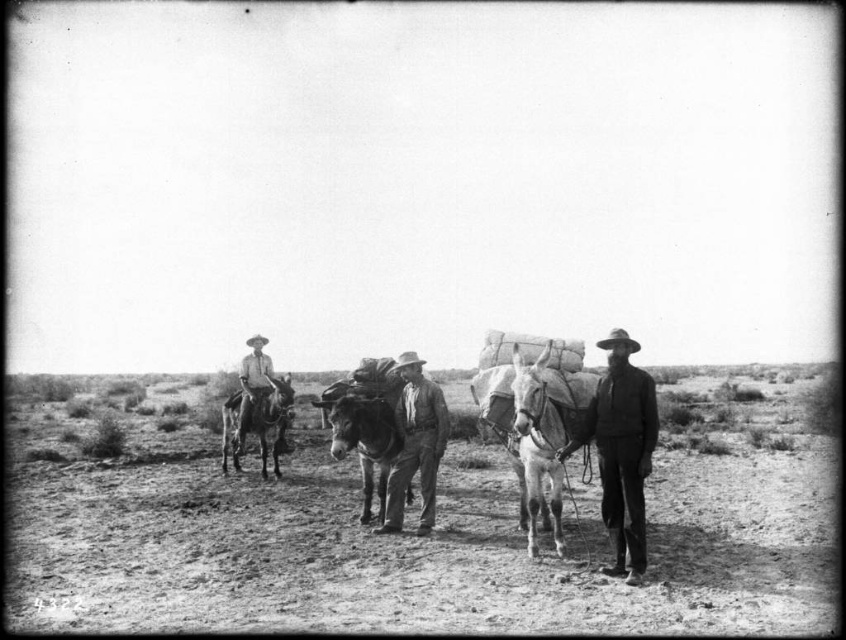
Can you confirm if shiny brown horse at center is positioned above shiny brown mule at left?

Indeed, shiny brown horse at center is positioned over shiny brown mule at left.

Image resolution: width=846 pixels, height=640 pixels. What do you see at coordinates (537, 451) in the screenshot?
I see `shiny brown horse at center` at bounding box center [537, 451].

This screenshot has width=846, height=640. In order to click on shiny brown horse at center in this screenshot , I will do `click(537, 451)`.

Is dirt field at center in front of shiny brown mule at left?

Yes, it is in front of shiny brown mule at left.

Does dirt field at center have a larger size compared to shiny brown mule at left?

Indeed, dirt field at center has a larger size compared to shiny brown mule at left.

Is point (113, 556) more distant than point (224, 435)?

No, (113, 556) is in front of (224, 435).

You are a GUI agent. You are given a task and a screenshot of the screen. Output one action in this format:
    pyautogui.click(x=<x>, y=<y>)
    Task: Click on the dirt field at center
    
    Given the screenshot: What is the action you would take?
    pyautogui.click(x=423, y=550)

Locate an element on the screen. dirt field at center is located at coordinates (423, 550).

Is dirt field at center above rough leather hat at center?

Incorrect, dirt field at center is not positioned above rough leather hat at center.

Who is more forward, (781, 392) or (646, 468)?

Positioned in front is point (646, 468).

I want to click on dirt field at center, so click(x=423, y=550).